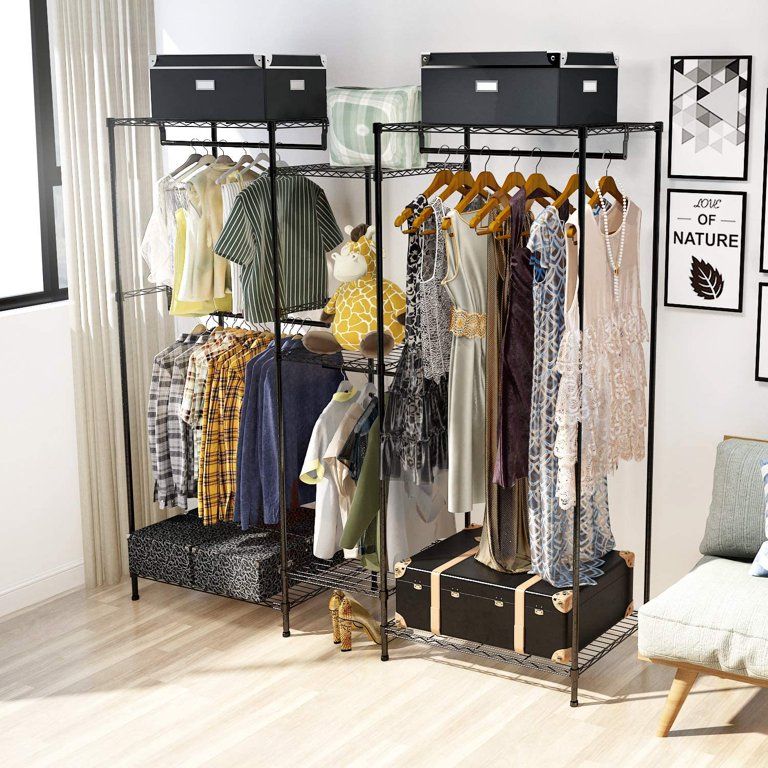
The height and width of the screenshot is (768, 768). In order to click on clothes hanging on the right most bar in this screenshot , I will do `click(597, 313)`, `click(547, 303)`, `click(521, 303)`, `click(498, 306)`, `click(475, 303)`, `click(442, 303)`, `click(409, 319)`.